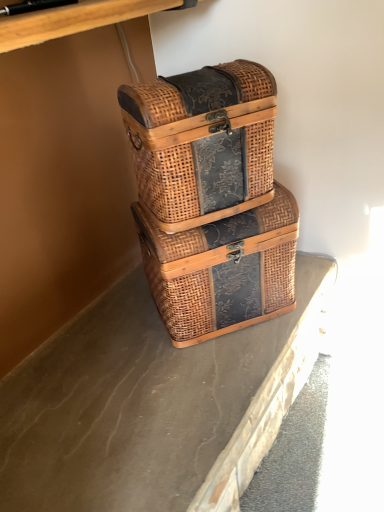
Image resolution: width=384 pixels, height=512 pixels. Identify the location of free space on the front side of woven brown picnic basket at center, acting as the 1th picnic basket starting from the bottom. (209, 376).